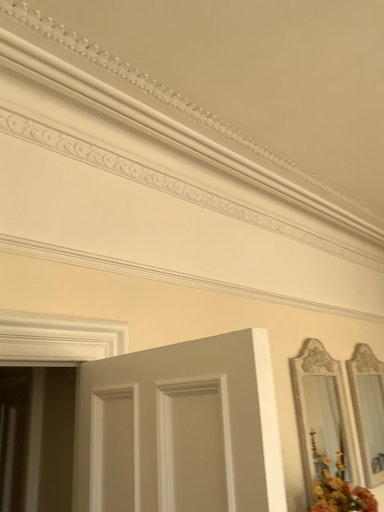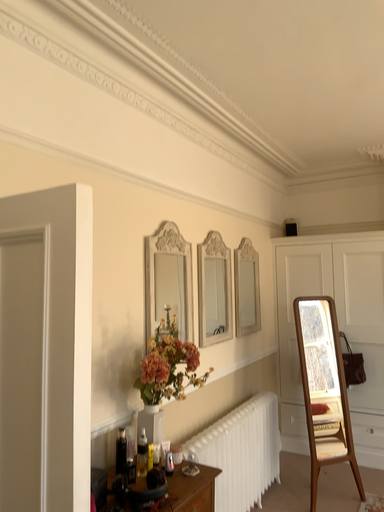
Question: Which way did the camera rotate in the video?

Choices:
 (A) rotated right
 (B) rotated left

Answer: (A)